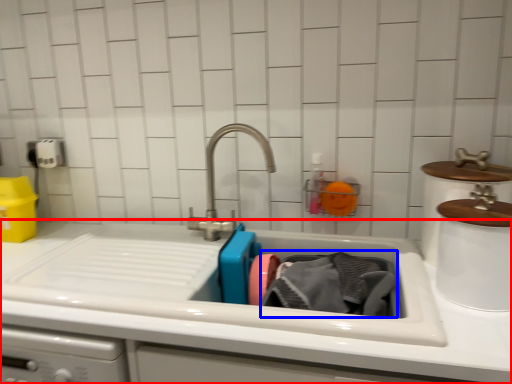
Question: Among these objects, which one is farthest to the camera, counter top (highlighted by a red box) or clothing (highlighted by a blue box)?

Choices:
 (A) counter top
 (B) clothing

Answer: (B)